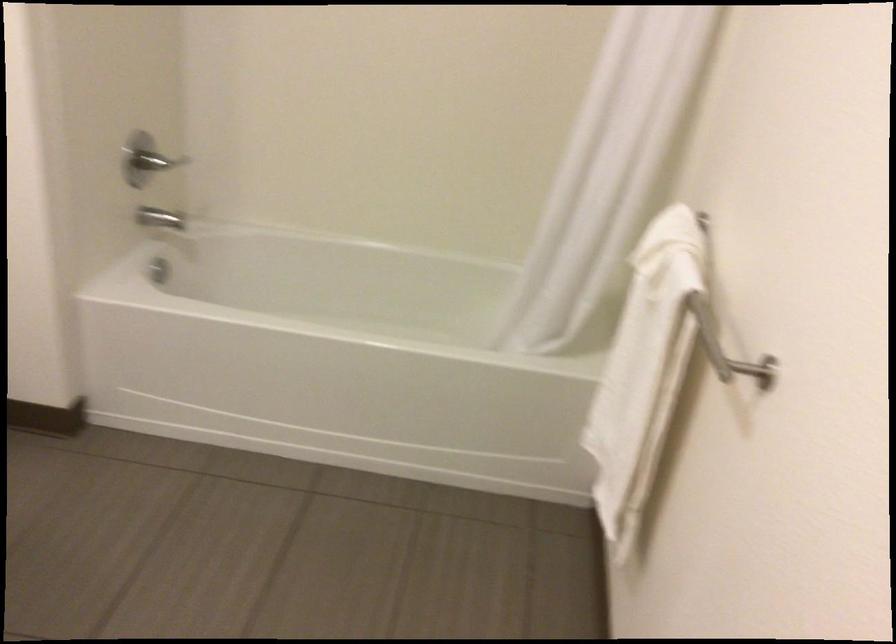
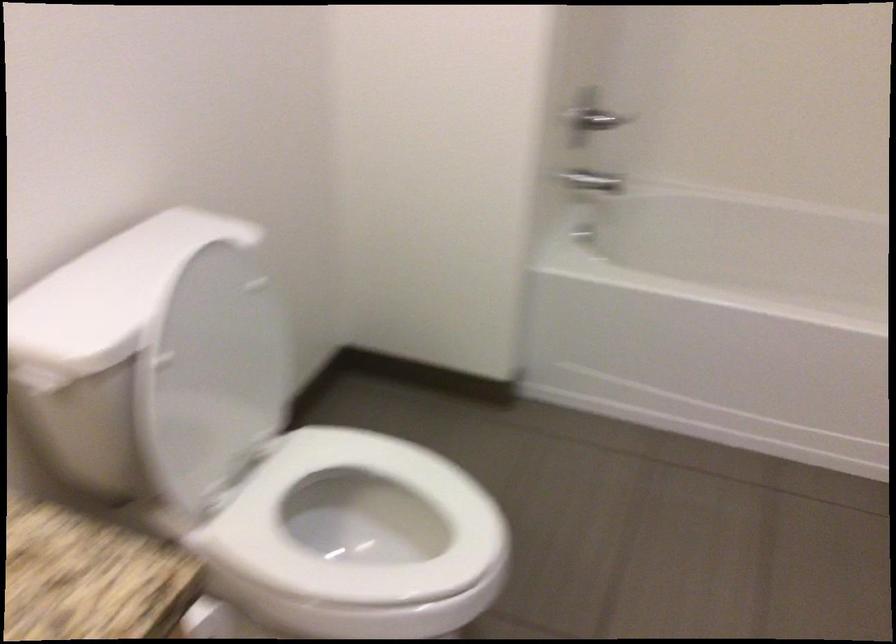
Question: The images are taken continuously from a first-person perspective. In which direction are you moving?

Choices:
 (A) Left
 (B) Right
 (C) Forward
 (D) Backward

Answer: (A)